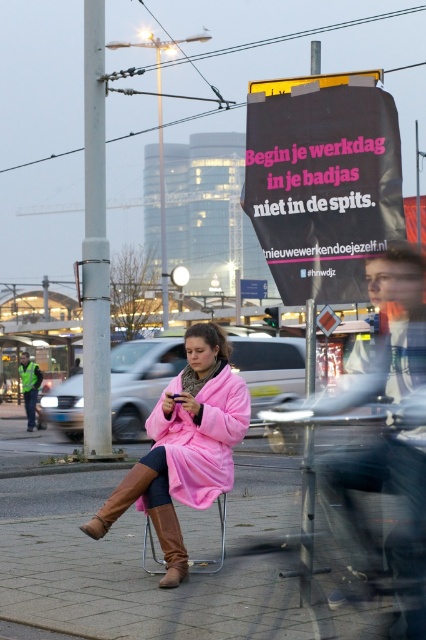
You are standing at the camera position and want to read the text on the black matte sign at upper center. Considering your height is 1.7 meters, can you reach the sign without moving your feet?

The distance between the black matte sign at upper center and the camera is 15.41 feet. Since you are 1.7 meters tall, you cannot reach the sign without moving your feet as it is too far away.

You are a photographer standing in front of the scene. You want to take a photo of both point (170, 381) and point (173, 525). Which point is closer to your camera?

Point (173, 525) is closer to the camera than point (170, 381) because the description states that point (170, 381) is further to the camera than point (173, 525).

You are a delivery robot positioned at the origin point of the coordinate system. The woman in the scene is wearing a bright pink coat and brown boots. You need to deliver a package to the exact location of the point at coordinate (120, 499). Based on the scene description, where should you deliver the package?

The point at coordinate (120, 499) is located on the brown leather boot at lower center, so you should deliver the package to the brown leather boot at lower center.